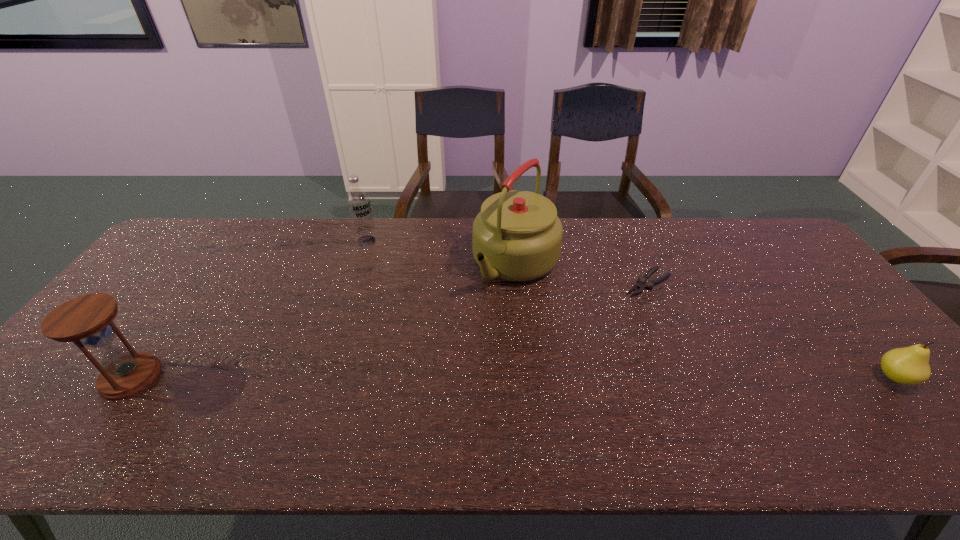
Select which object appears as the closest to the vodka. Please provide its 2D coordinates. Your answer should be formatted as a tuple, i.e. [(x, y)], where the tuple contains the x and y coordinates of a point satisfying the conditions above.

[(517, 236)]

Locate which object is the third closest to the kettle. Please provide its 2D coordinates. Your answer should be formatted as a tuple, i.e. [(x, y)], where the tuple contains the x and y coordinates of a point satisfying the conditions above.

[(910, 365)]

Locate an element on the screen. free space that satisfies the following two spatial constraints: 1. on the front side of the second object from right to left; 2. on the left side of the second shortest object is located at coordinates (688, 377).

Identify the location of vacant area that satisfies the following two spatial constraints: 1. on the back side of the hourglass; 2. on the right side of the second object from left to right. The image size is (960, 540). [228, 241].

Find the location of `vacant space that satisfies the following two spatial constraints: 1. on the front side of the leftmost object; 2. on the left side of the second shortest object`. vacant space that satisfies the following two spatial constraints: 1. on the front side of the leftmost object; 2. on the left side of the second shortest object is located at coordinates (130, 377).